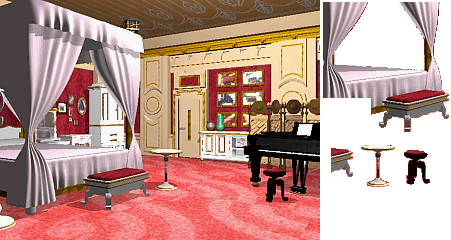
What are the coordinates of `art work` in the screenshot? It's located at (225, 78), (251, 79), (247, 89), (219, 94).